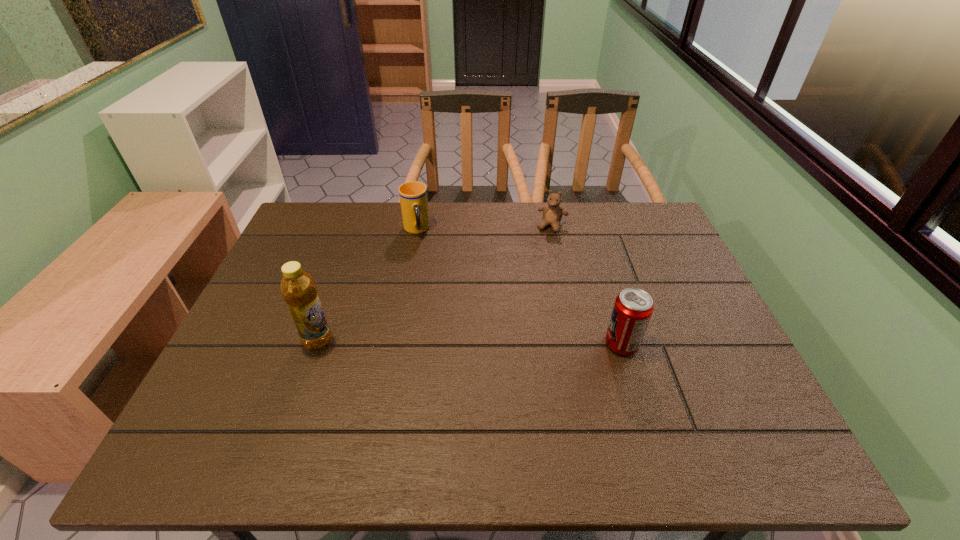
I want to click on vacant point at the far left corner, so click(x=309, y=211).

Locate an element on the screen. This screenshot has height=540, width=960. vacant region between the tallest object and the rightmost object is located at coordinates (469, 342).

Where is `free spot between the second object from left to right and the soda can`? This screenshot has width=960, height=540. free spot between the second object from left to right and the soda can is located at coordinates (519, 287).

At what (x,y) coordinates should I click in order to perform the action: click on vacant region between the cup and the tallest object. Please return your answer as a coordinate pair (x, y). This screenshot has height=540, width=960. Looking at the image, I should click on (367, 286).

This screenshot has width=960, height=540. Identify the location of empty space between the soda can and the shortest object. (587, 285).

Find the location of `free space between the rightmost object and the second object from left to right`. free space between the rightmost object and the second object from left to right is located at coordinates (519, 287).

The height and width of the screenshot is (540, 960). I want to click on free spot between the rightmost object and the tallest object, so click(469, 342).

Find the location of a particular element. vacant point located between the cup and the leftmost object is located at coordinates (367, 286).

Locate an element on the screen. vacant space in between the leftmost object and the third object from right to left is located at coordinates (367, 286).

You are a GUI agent. You are given a task and a screenshot of the screen. Output one action in this format:
    pyautogui.click(x=<x>, y=<y>)
    Task: Click on the free space between the tallest object and the teddy bear
    
    Given the screenshot: What is the action you would take?
    pyautogui.click(x=435, y=284)